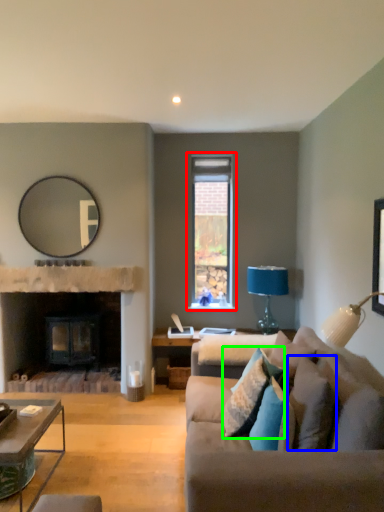
Question: Based on their relative distances, which object is nearer to window (highlighted by a red box)? Choose from pillow (highlighted by a blue box) and pillow (highlighted by a green box).

Choices:
 (A) pillow
 (B) pillow

Answer: (B)